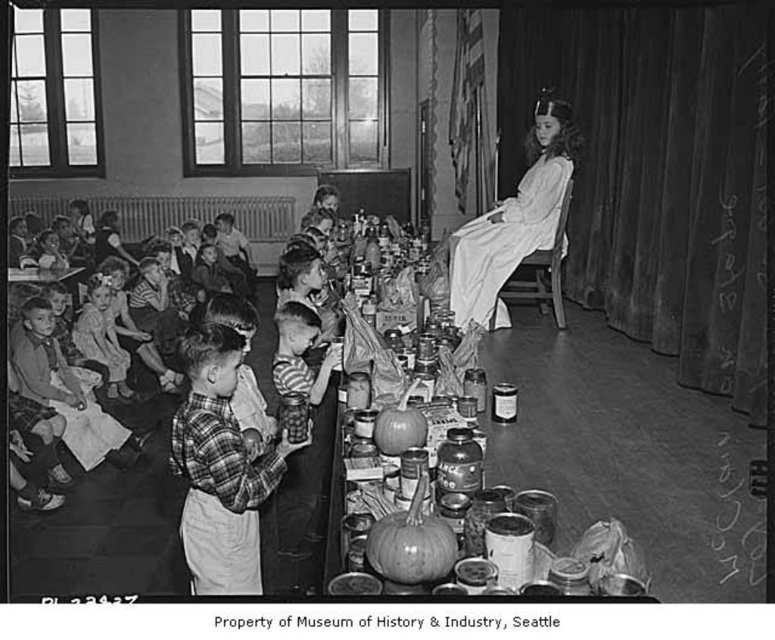
Question: Can you confirm if striped shirt at center is positioned to the right of smooth wooden table at center?

Choices:
 (A) yes
 (B) no

Answer: (B)

Question: Which point is closer to the camera taking this photo?

Choices:
 (A) (288, 369)
 (B) (105, 333)
 (C) (532, 468)
 (D) (209, 492)

Answer: (D)

Question: Can you confirm if plaid fabric shirt at center is positioned above smooth wooden table at center?

Choices:
 (A) yes
 (B) no

Answer: (A)

Question: Is plaid fabric shirt at center below striped shirt at center?

Choices:
 (A) no
 (B) yes

Answer: (B)

Question: Which point is farther to the camera?

Choices:
 (A) (212, 358)
 (B) (305, 388)
 (C) (548, 120)
 (D) (90, 296)

Answer: (D)

Question: Which point is farther to the camera?

Choices:
 (A) (245, 445)
 (B) (476, 323)
 (C) (288, 316)
 (D) (505, 480)

Answer: (B)